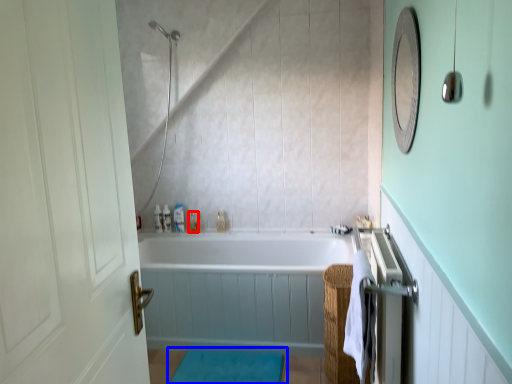
Question: Which of the following is the closest to the observer, toiletry (highlighted by a red box) or bath mat (highlighted by a blue box)?

Choices:
 (A) toiletry
 (B) bath mat

Answer: (B)